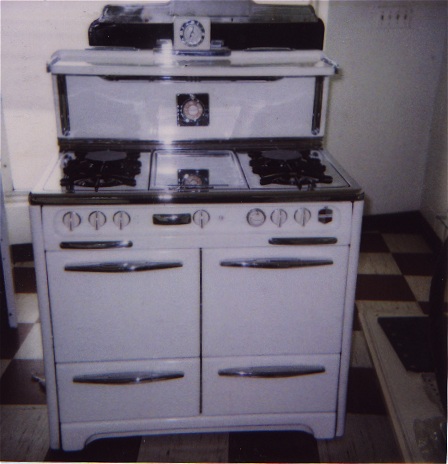
Locate an element on the screen. This screenshot has width=448, height=464. knobs is located at coordinates (69, 218), (93, 221), (116, 216), (201, 214), (280, 216), (304, 218).